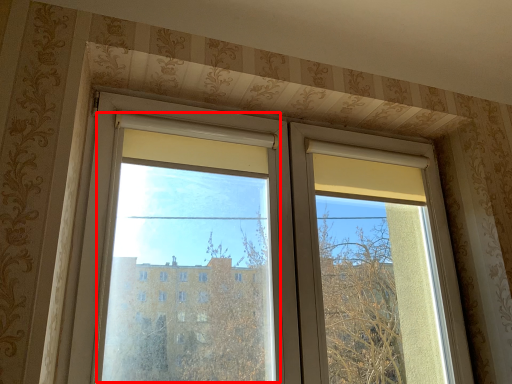
Question: Considering the relative positions of window screen (annotated by the red box) and window in the image provided, where is window screen (annotated by the red box) located with respect to the staircase?

Choices:
 (A) left
 (B) right

Answer: (A)